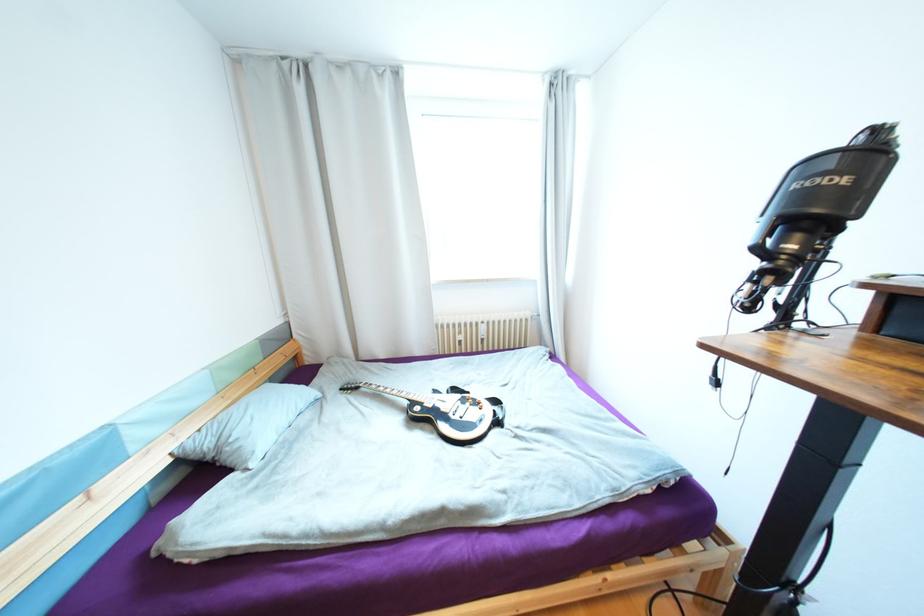
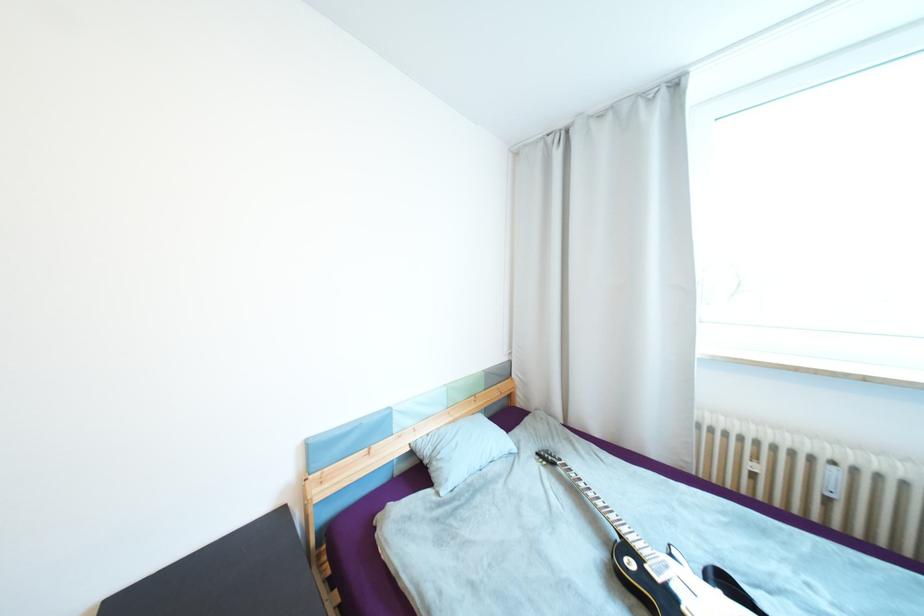
Question: Based on the continuous images, in which direction is the camera rotating? Reply with the corresponding letter.

Choices:
 (A) Left
 (B) Right
 (C) Up
 (D) Down

Answer: (A)